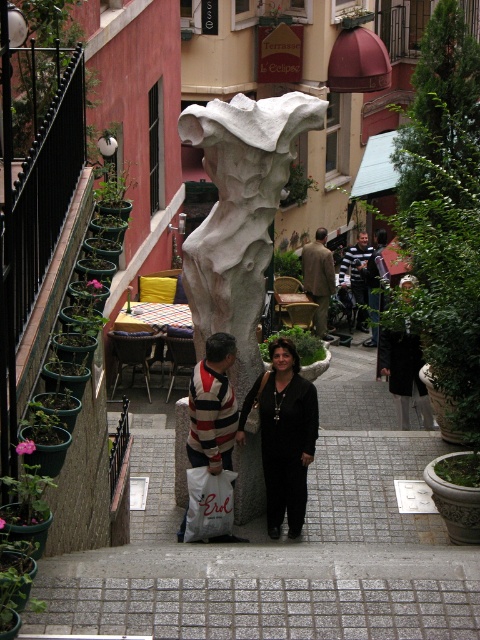
Question: Which of these objects is positioned farthest from the black leather coat at center?

Choices:
 (A) brown wool coat at center
 (B) matte black jacket at center
 (C) white matte shopping bag at center

Answer: (B)

Question: Does brown wool coat at center have a lesser width compared to striped sweater at center?

Choices:
 (A) yes
 (B) no

Answer: (A)

Question: Among these points, which one is nearest to the camera?

Choices:
 (A) (253, 211)
 (B) (350, 260)
 (C) (310, 292)

Answer: (A)

Question: Does white matte shopping bag at center have a greater width compared to matte black jacket at center?

Choices:
 (A) no
 (B) yes

Answer: (A)

Question: Estimate the real-world distances between objects in this image. Which object is farther from the white matte shopping bag at center?

Choices:
 (A) black glossy dress at center
 (B) matte black jacket at center

Answer: (B)

Question: Can you confirm if black leather coat at center is positioned to the right of black glossy dress at center?

Choices:
 (A) yes
 (B) no

Answer: (B)